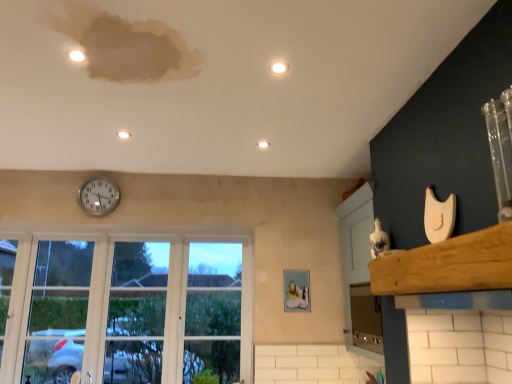
In order to face silver metallic clock at upper center, should I rotate leftwards or rightwards?

A 20.199 degree turn to the left will do.

The width and height of the screenshot is (512, 384). What do you see at coordinates (126, 307) in the screenshot?
I see `clear glass window at lower left` at bounding box center [126, 307].

The width and height of the screenshot is (512, 384). I want to click on wooden at upper right, so click(448, 265).

Locate an element on the screen. The width and height of the screenshot is (512, 384). matte white light at upper center, which ranks as the second light in bottom-to-top order is located at coordinates (123, 134).

Find the location of a particular element. The width and height of the screenshot is (512, 384). silver metallic clock at upper center is located at coordinates (98, 196).

In the scene shown: Are white glossy light at upper center, positioned as the third light in back-to-front order, and white glossy light at center, the second light positioned from the right, making contact?

white glossy light at upper center, positioned as the third light in back-to-front order, and white glossy light at center, the second light positioned from the right, are not in contact.

From the image's perspective, count 2nd lights upward from the white glossy light at center, which appears as the 1th light when ordered from the bottom, and point to it. Please provide its 2D coordinates.

[(279, 67)]

Can you confirm if white glossy light at upper center, which is the 1th light in right-to-left order, is positioned to the right of white glossy light at center, the second light positioned from the right?

Correct, you'll find white glossy light at upper center, which is the 1th light in right-to-left order, to the right of white glossy light at center, the second light positioned from the right.

Does silver metallic clock at upper center lie in front of white glossy light at center, which appears as the 2th light when viewed from the left?

No, it is behind white glossy light at center, which appears as the 2th light when viewed from the left.

From a real-world perspective, is silver metallic clock at upper center physically located above or below white glossy light at center, the 1th light positioned from the back?

In terms of real-world spatial position, silver metallic clock at upper center is below white glossy light at center, the 1th light positioned from the back.

Based on the photo, is silver metallic clock at upper center further to the viewer compared to white glossy light at upper center, which is counted as the 3th light, starting from the left?

Yes, the depth of silver metallic clock at upper center is greater than that of white glossy light at upper center, which is counted as the 3th light, starting from the left.

Is silver metallic clock at upper center smaller than white glossy light at upper center, the 1th light viewed from the top?

No.

Is silver metallic clock at upper center oriented away from white glossy light at upper center, the 1th light viewed from the top?

No, silver metallic clock at upper center's orientation is not away from white glossy light at upper center, the 1th light viewed from the top.

Consider the image. From the image's perspective, which object appears higher, silver metallic clock at upper center or white glossy light at upper center, the 1th light viewed from the top?

white glossy light at upper center, the 1th light viewed from the top, appears higher in the image.

Is silver metallic clock at upper center further to camera compared to wooden at upper right?

Yes, it is behind wooden at upper right.

Could you tell me if silver metallic clock at upper center is turned towards wooden at upper right?

No.

Is point (109, 212) behind point (510, 269)?

Yes, it is behind point (510, 269).

The width and height of the screenshot is (512, 384). Find the location of `window sill that appears below the silver metallic clock at upper center (from a real-world perspective)`. window sill that appears below the silver metallic clock at upper center (from a real-world perspective) is located at coordinates (448, 265).

From a real-world perspective, who is located higher, wooden at upper right or white glossy light at upper center, positioned as the third light in back-to-front order?

white glossy light at upper center, positioned as the third light in back-to-front order, from a real-world perspective.

In the scene shown: Is wooden at upper right far away from white glossy light at upper center, the 3th light in the bottom-to-top sequence?

Yes.

From the picture: Considering the relative sizes of wooden at upper right and white glossy light at upper center, which is counted as the 3th light, starting from the left, in the image provided, is wooden at upper right bigger than white glossy light at upper center, which is counted as the 3th light, starting from the left,?

Yes, wooden at upper right is bigger than white glossy light at upper center, which is counted as the 3th light, starting from the left.

Is clear glass window at lower left a part of wooden at upper right?

That's incorrect, clear glass window at lower left is not inside wooden at upper right.

Who is bigger, wooden at upper right or clear glass window at lower left?

With larger size is clear glass window at lower left.

The width and height of the screenshot is (512, 384). I want to click on window that appears below the wooden at upper right (from the image's perspective), so click(126, 307).

Considering the sizes of objects wooden at upper right and clear glass window at lower left in the image provided, who is wider, wooden at upper right or clear glass window at lower left?

wooden at upper right.

Is satin silver oven at lower right shorter than silver metallic clock at upper center?

No, satin silver oven at lower right is not shorter than silver metallic clock at upper center.

Is satin silver oven at lower right positioned far away from silver metallic clock at upper center?

satin silver oven at lower right is positioned a significant distance from silver metallic clock at upper center.

Could you tell me if satin silver oven at lower right is facing silver metallic clock at upper center?

No, satin silver oven at lower right is not oriented towards silver metallic clock at upper center.

Where is `light located on the right of white glossy light at center, the 1th light positioned from the back`? light located on the right of white glossy light at center, the 1th light positioned from the back is located at coordinates (279, 67).

The height and width of the screenshot is (384, 512). What are the coordinates of `clock that is under the white glossy light at center, which appears as the 2th light when viewed from the left (from a real-world perspective)` in the screenshot? It's located at (98, 196).

Which object lies further to the anchor point wooden at upper right, white glossy light at center, which appears as the 2th light when viewed from the left, or white glossy light at upper center, the 3th light in the bottom-to-top sequence?

Based on the image, white glossy light at center, which appears as the 2th light when viewed from the left, appears to be further to wooden at upper right.

From the image, which object appears to be farther from wooden at upper right, white glossy light at center, which appears as the 1th light when ordered from the bottom, or silver metallic clock at upper center?

Based on the image, silver metallic clock at upper center appears to be further to wooden at upper right.

From the picture: Based on their spatial positions, is clear glass window at lower left or matte white light at upper center, placed as the 2th light when sorted from front to back, closer to white glossy light at upper center, positioned as the third light in back-to-front order?

matte white light at upper center, placed as the 2th light when sorted from front to back.

When comparing their distances from clear glass window at lower left, does satin silver oven at lower right or white glossy light at center, the 1th light positioned from the back, seem further?

Based on the image, white glossy light at center, the 1th light positioned from the back, appears to be further to clear glass window at lower left.

Estimate the real-world distances between objects in this image. Which object is closer to matte white light at upper center, marked as the 1th light in a left-to-right arrangement, silver metallic clock at upper center or white glossy light at center, acting as the third light starting from the front?

white glossy light at center, acting as the third light starting from the front, is closer to matte white light at upper center, marked as the 1th light in a left-to-right arrangement.

Consider the image. Which object lies nearer to the anchor point satin silver oven at lower right, matte white light at upper center, marked as the 1th light in a left-to-right arrangement, or white glossy light at upper center, the 1th light viewed from the top?

white glossy light at upper center, the 1th light viewed from the top, is closer to satin silver oven at lower right.

Consider the image. Estimate the real-world distances between objects in this image. Which object is further from satin silver oven at lower right, matte white light at upper center, marked as the 1th light in a left-to-right arrangement, or clear glass window at lower left?

matte white light at upper center, marked as the 1th light in a left-to-right arrangement, is further to satin silver oven at lower right.

Considering their positions, is white glossy light at center, which appears as the 1th light when ordered from the bottom, positioned further to wooden at upper right than satin silver oven at lower right?

white glossy light at center, which appears as the 1th light when ordered from the bottom.

In order to click on window between wooden at upper right and silver metallic clock at upper center along the z-axis in this screenshot , I will do `click(126, 307)`.

Find the location of a particular element. The image size is (512, 384). light between matte white light at upper center, acting as the 2th light starting from the back, and white glossy light at upper center, the 1th light viewed from the top, in the horizontal direction is located at coordinates (263, 144).

This screenshot has height=384, width=512. What are the coordinates of `light between matte white light at upper center, placed as the 2th light when sorted from front to back, and clear glass window at lower left, in the vertical direction` in the screenshot? It's located at (263, 144).

At what (x,y) coordinates should I click in order to perform the action: click on light situated between silver metallic clock at upper center and white glossy light at center, which appears as the 2th light when viewed from the left, from left to right. Please return your answer as a coordinate pair (x, y). Looking at the image, I should click on (123, 134).